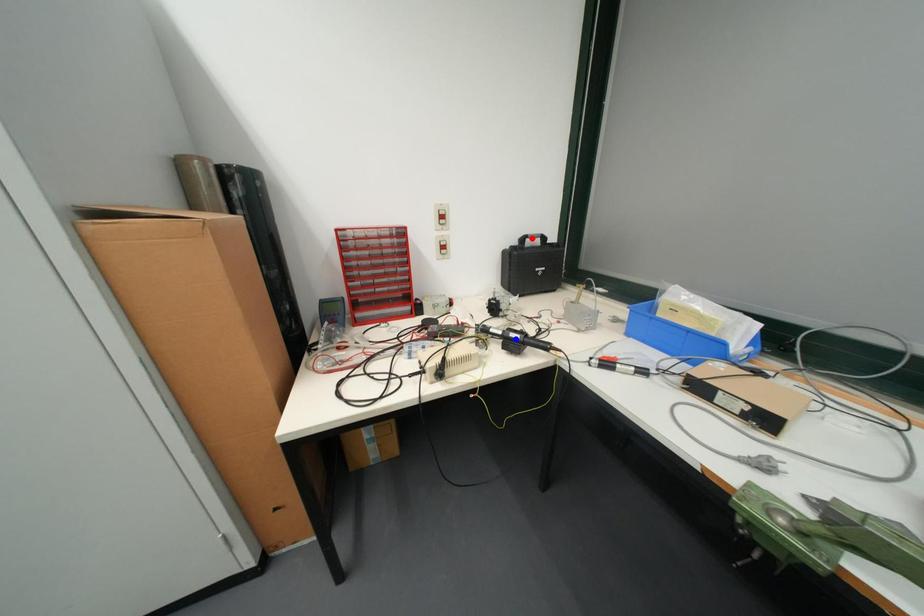
Question: Which of the two points in the image is closer to the camera?

Choices:
 (A) Blue point is closer.
 (B) Red point is closer.

Answer: (A)